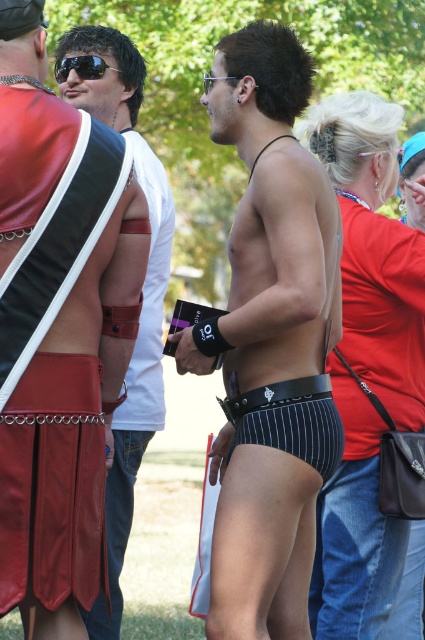
Consider the image. Who is lower down, leather shorts at lower center or shiny black sunglasses at upper left?

leather shorts at lower center is lower down.

Is leather shorts at lower center thinner than shiny black sunglasses at upper left?

No, leather shorts at lower center is not thinner than shiny black sunglasses at upper left.

Describe the element at coordinates (53, 484) in the screenshot. I see `leather shorts at lower center` at that location.

The height and width of the screenshot is (640, 425). Find the location of `leather shorts at lower center`. leather shorts at lower center is located at coordinates (53, 484).

Does black pinstripe underwear at center have a lesser width compared to black mesh bikini top at center?

No.

Does point (300, 397) lie behind point (362, 179)?

No, it is not.

Where is `black pinstripe underwear at center`? black pinstripe underwear at center is located at coordinates (269, 340).

Based on the photo, can you confirm if black mesh bikini top at center is positioned below shiny black sunglasses at upper left?

Yes, black mesh bikini top at center is below shiny black sunglasses at upper left.

Who is more forward, (405,548) or (85,60)?

Point (405,548) is in front.

Is point (311, 115) closer to viewer compared to point (65, 58)?

Yes.

Identify the location of black mesh bikini top at center. Image resolution: width=425 pixels, height=640 pixels. (374, 250).